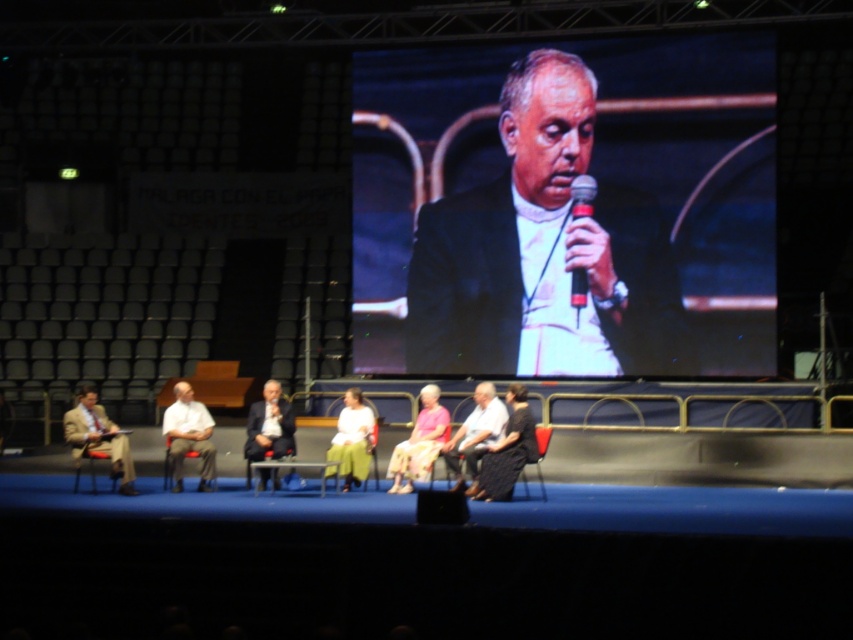
Consider the image. Between black textured dress at lower center and white fabric skirt at center, which one is positioned higher?

black textured dress at lower center is above.

What do you see at coordinates (508, 451) in the screenshot? The image size is (853, 640). I see `black textured dress at lower center` at bounding box center [508, 451].

The image size is (853, 640). What do you see at coordinates (508, 451) in the screenshot?
I see `black textured dress at lower center` at bounding box center [508, 451].

Find the location of a particular element. This screenshot has width=853, height=640. black textured dress at lower center is located at coordinates (508, 451).

Who is more forward, (264, 413) or (576, 186)?

Point (264, 413)

Who is positioned more to the right, dark suit at center or black plastic microphone at center?

black plastic microphone at center is more to the right.

What do you see at coordinates (270, 424) in the screenshot?
I see `dark suit at center` at bounding box center [270, 424].

The height and width of the screenshot is (640, 853). Find the location of `dark suit at center`. dark suit at center is located at coordinates (270, 424).

Can you confirm if black textured dress at lower center is positioned above black plastic microphone at center?

No.

Can you confirm if black textured dress at lower center is thinner than black plastic microphone at center?

No, black textured dress at lower center is not thinner than black plastic microphone at center.

Which is behind, point (521, 417) or point (577, 296)?

The point (577, 296) is behind.

Where is `black textured dress at lower center`? This screenshot has width=853, height=640. black textured dress at lower center is located at coordinates (508, 451).